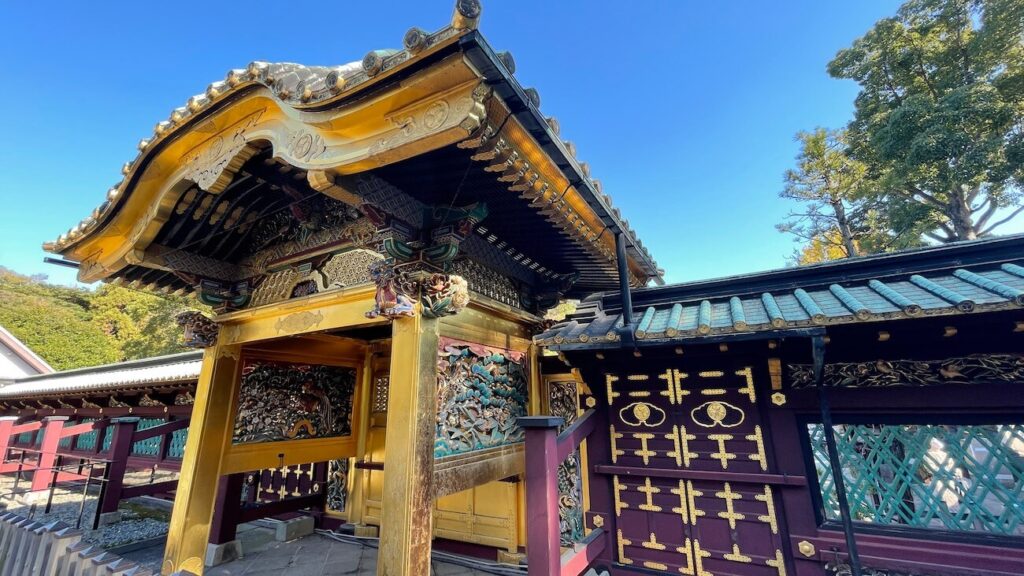
Find the location of a particular element. This screenshot has height=576, width=1024. gold square pillar is located at coordinates (403, 511), (200, 457).